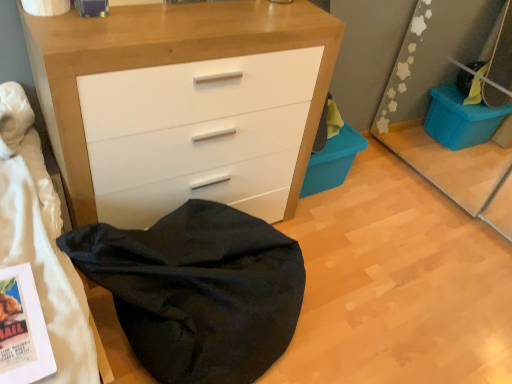
Identify the location of matte white chest of drawers at center. The image size is (512, 384). (169, 63).

What is the approximate height of matte white chest of drawers at center?

It is 35.19 inches.

This screenshot has width=512, height=384. Describe the element at coordinates (198, 290) in the screenshot. I see `black fabric bean bag at lower left` at that location.

Image resolution: width=512 pixels, height=384 pixels. I want to click on matte white chest of drawers at center, so click(x=169, y=63).

Is matte white chest of drawers at center next to black fabric bean bag at lower left?

matte white chest of drawers at center is not next to black fabric bean bag at lower left, and they're not touching.

Based on their sizes in the image, would you say matte white chest of drawers at center is bigger or smaller than black fabric bean bag at lower left?

Clearly, matte white chest of drawers at center is larger in size than black fabric bean bag at lower left.

Who is shorter, matte white chest of drawers at center or black fabric bean bag at lower left?

With less height is black fabric bean bag at lower left.

From the picture: Is black fabric bean bag at lower left completely or partially inside matte white chest of drawers at center?

Actually, black fabric bean bag at lower left is outside matte white chest of drawers at center.

Are blue plastic storage bin at lower right and black fabric bean bag at lower left beside each other?

They are not placed beside each other.

Find the location of a particular element. cabinetry that appears above the black fabric bean bag at lower left (from the image's perspective) is located at coordinates (332, 161).

Do you think blue plastic storage bin at lower right is within black fabric bean bag at lower left, or outside of it?

blue plastic storage bin at lower right exists outside the volume of black fabric bean bag at lower left.

Measure the distance from blue plastic storage bin at lower right to black fabric bean bag at lower left.

They are 31.74 inches apart.

From a real-world perspective, relative to blue plastic storage bin at lower right, is matte white chest of drawers at center vertically above or below?

From a real-world perspective, matte white chest of drawers at center is physically above blue plastic storage bin at lower right.

Which is more to the left, matte white chest of drawers at center or blue plastic storage bin at lower right?

matte white chest of drawers at center.

Between matte white chest of drawers at center and blue plastic storage bin at lower right, which one has smaller width?

With smaller width is blue plastic storage bin at lower right.

Do you think matte white chest of drawers at center is within blue plastic storage bin at lower right, or outside of it?

matte white chest of drawers at center cannot be found inside blue plastic storage bin at lower right.

Based on the photo, can you confirm if black fabric bean bag at lower left is shorter than blue plastic storage bin at lower right?

Incorrect, the height of black fabric bean bag at lower left does not fall short of that of blue plastic storage bin at lower right.

Which of these two, black fabric bean bag at lower left or blue plastic storage bin at lower right, is bigger?

black fabric bean bag at lower left.

Looking at this image, from a real-world perspective, does black fabric bean bag at lower left sit lower than blue plastic storage bin at lower right?

Actually, black fabric bean bag at lower left is physically above blue plastic storage bin at lower right in the real world.

From the image's perspective, would you say black fabric bean bag at lower left is positioned over blue plastic storage bin at lower right?

No, from the image's perspective, black fabric bean bag at lower left is not above blue plastic storage bin at lower right.

Is point (143, 321) in front of point (130, 7)?

Yes, point (143, 321) is in front of point (130, 7).

Does black fabric bean bag at lower left have a lesser width compared to matte white chest of drawers at center?

No.

Is black fabric bean bag at lower left to the left or to the right of matte white chest of drawers at center in the image?

From the image, it's evident that black fabric bean bag at lower left is to the right of matte white chest of drawers at center.

Can you confirm if black fabric bean bag at lower left is taller than matte white chest of drawers at center?

Incorrect, the height of black fabric bean bag at lower left is not larger of that of matte white chest of drawers at center.

How many degrees apart are the facing directions of blue plastic storage bin at lower right and matte white chest of drawers at center?

The angle between the facing direction of blue plastic storage bin at lower right and the facing direction of matte white chest of drawers at center is 0.000125 degrees.

Is point (332, 155) closer or farther from the camera than point (27, 40)?

Point (332, 155).

From the image's perspective, is blue plastic storage bin at lower right located above matte white chest of drawers at center?

No, from the image's perspective, blue plastic storage bin at lower right is not over matte white chest of drawers at center.

Between blue plastic storage bin at lower right and matte white chest of drawers at center, which one has larger width?

matte white chest of drawers at center is wider.

Image resolution: width=512 pixels, height=384 pixels. Identify the location of chest of drawers that is on the left side of black fabric bean bag at lower left. (169, 63).

This screenshot has height=384, width=512. Identify the location of bean bag chair above the blue plastic storage bin at lower right (from a real-world perspective). (198, 290).

When comparing their distances from blue plastic storage bin at lower right, does black fabric bean bag at lower left or matte white chest of drawers at center seem closer?

Among the two, matte white chest of drawers at center is located nearer to blue plastic storage bin at lower right.

Based on their spatial positions, is blue plastic storage bin at lower right or matte white chest of drawers at center closer to black fabric bean bag at lower left?

matte white chest of drawers at center is closer to black fabric bean bag at lower left.

Estimate the real-world distances between objects in this image. Which object is closer to blue plastic storage bin at lower right, matte white chest of drawers at center or black fabric bean bag at lower left?

Among the two, matte white chest of drawers at center is located nearer to blue plastic storage bin at lower right.

Looking at the image, which one is located closer to matte white chest of drawers at center, black fabric bean bag at lower left or blue plastic storage bin at lower right?

black fabric bean bag at lower left is positioned closer to the anchor matte white chest of drawers at center.

From the image, which object appears to be farther from black fabric bean bag at lower left, matte white chest of drawers at center or blue plastic storage bin at lower right?

blue plastic storage bin at lower right lies further to black fabric bean bag at lower left than the other object.

Looking at the image, which one is located further to matte white chest of drawers at center, blue plastic storage bin at lower right or black fabric bean bag at lower left?

blue plastic storage bin at lower right lies further to matte white chest of drawers at center than the other object.

You are a GUI agent. You are given a task and a screenshot of the screen. Output one action in this format:
    pyautogui.click(x=<x>, y=<y>)
    Task: Click on the chest of drawers positioned between black fabric bean bag at lower left and blue plastic storage bin at lower right from near to far
    This screenshot has height=384, width=512.
    Given the screenshot: What is the action you would take?
    pyautogui.click(x=169, y=63)